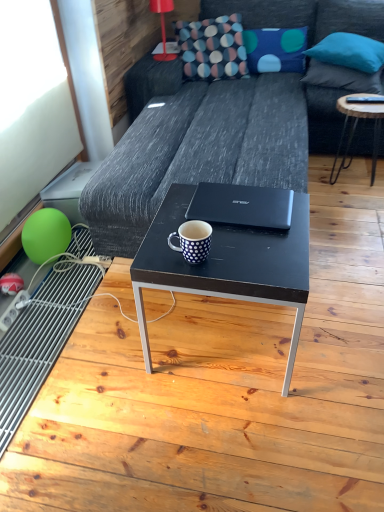
The image size is (384, 512). Find the location of `vacant space to the right of white dotted mug at center`. vacant space to the right of white dotted mug at center is located at coordinates (247, 253).